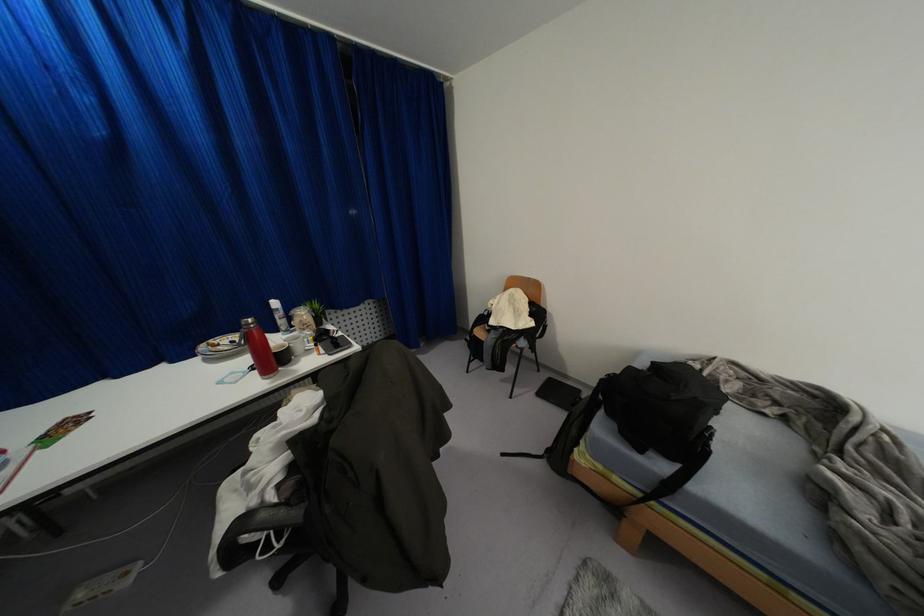
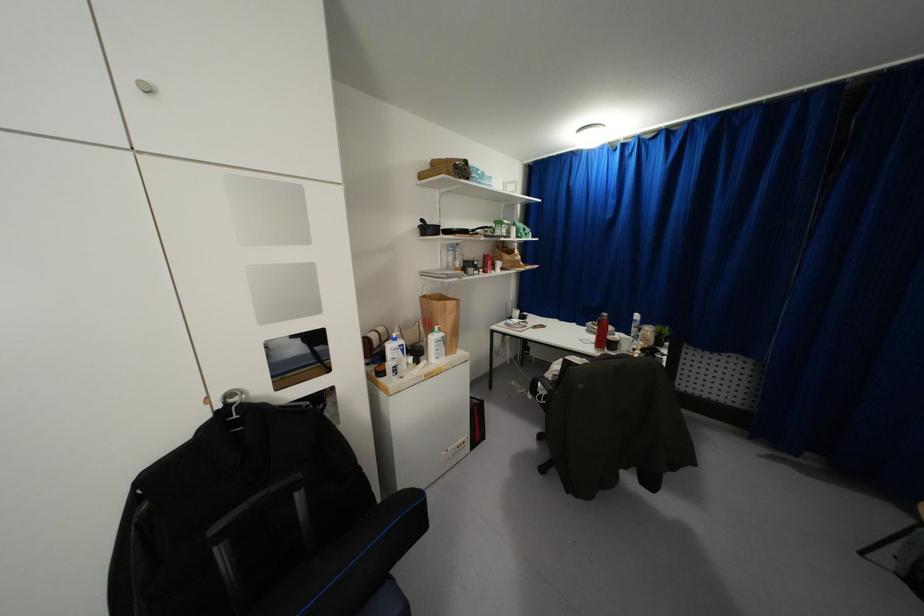
The point at (277, 485) is marked in the first image. Where is the corresponding point in the second image?

(553, 376)